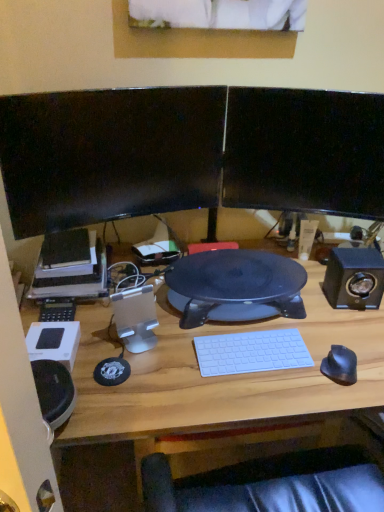
Where is `free space in front of white plastic keyboard at center`? This screenshot has height=512, width=384. free space in front of white plastic keyboard at center is located at coordinates (249, 395).